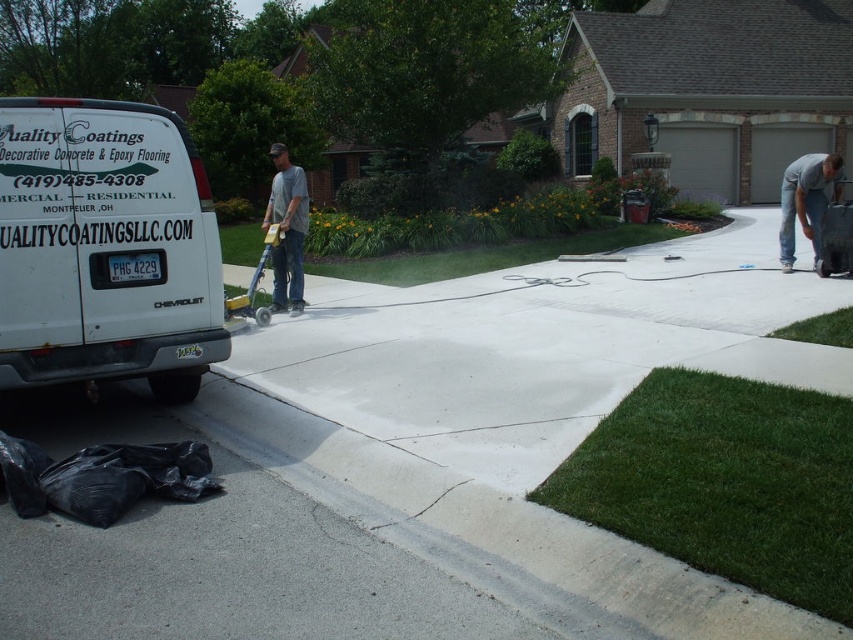
Question: Which is nearer to the gray matte t-shirt at center?

Choices:
 (A) white matte van at left
 (B) gray cotton shirt at upper right
 (C) smooth concrete driveway at center

Answer: (A)

Question: Is smooth concrete driveway at center wider than gray cotton shirt at upper right?

Choices:
 (A) yes
 (B) no

Answer: (B)

Question: Is white matte van at left in front of gray matte t-shirt at center?

Choices:
 (A) yes
 (B) no

Answer: (A)

Question: Which point appears farthest from the camera in this image?

Choices:
 (A) (827, 193)
 (B) (155, 250)
 (C) (212, 550)

Answer: (A)

Question: Does white matte van at left lie in front of gray cotton shirt at upper right?

Choices:
 (A) yes
 (B) no

Answer: (A)

Question: Which of the following is the farthest from the observer?

Choices:
 (A) gray cotton shirt at upper right
 (B) smooth concrete driveway at center
 (C) gray matte t-shirt at center

Answer: (A)